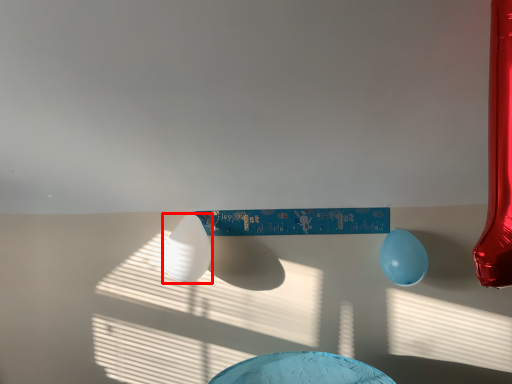
Question: In this image, where is balloon (annotated by the red box) located relative to balloon?

Choices:
 (A) right
 (B) left

Answer: (B)